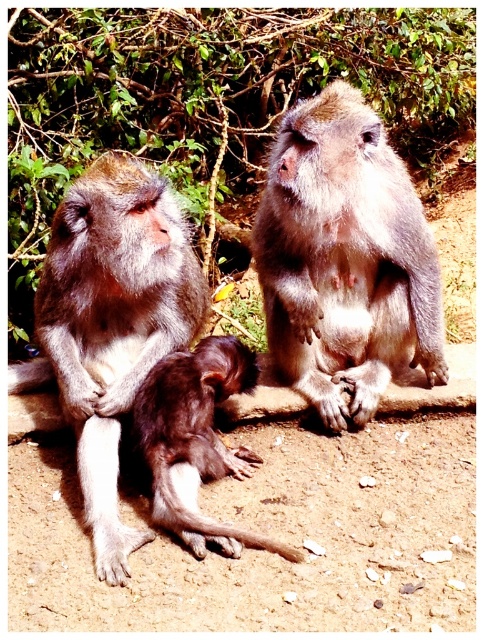
Question: Does gray furry monkey at center have a lesser width compared to dark brown fur monkey at center?

Choices:
 (A) yes
 (B) no

Answer: (B)

Question: Based on their relative distances, which object is farther from the dark brown fur monkey at center?

Choices:
 (A) gray furry monkey at left
 (B) gray furry monkey at center

Answer: (B)

Question: Which point appears closest to the camera in this image?

Choices:
 (A) (349, 186)
 (B) (75, 300)
 (C) (181, 404)

Answer: (C)

Question: Does gray furry monkey at left have a greater width compared to dark brown fur monkey at center?

Choices:
 (A) yes
 (B) no

Answer: (A)

Question: Which point is closer to the camera taking this photo?

Choices:
 (A) (409, 362)
 (B) (18, 390)
 (C) (148, 397)

Answer: (C)

Question: Can you confirm if gray furry monkey at left is smaller than dark brown fur monkey at center?

Choices:
 (A) yes
 (B) no

Answer: (B)